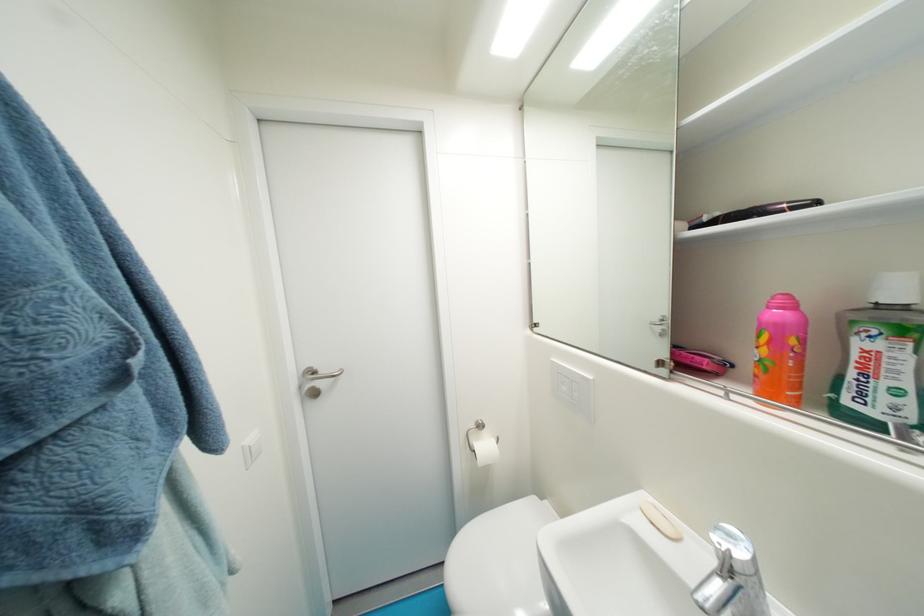
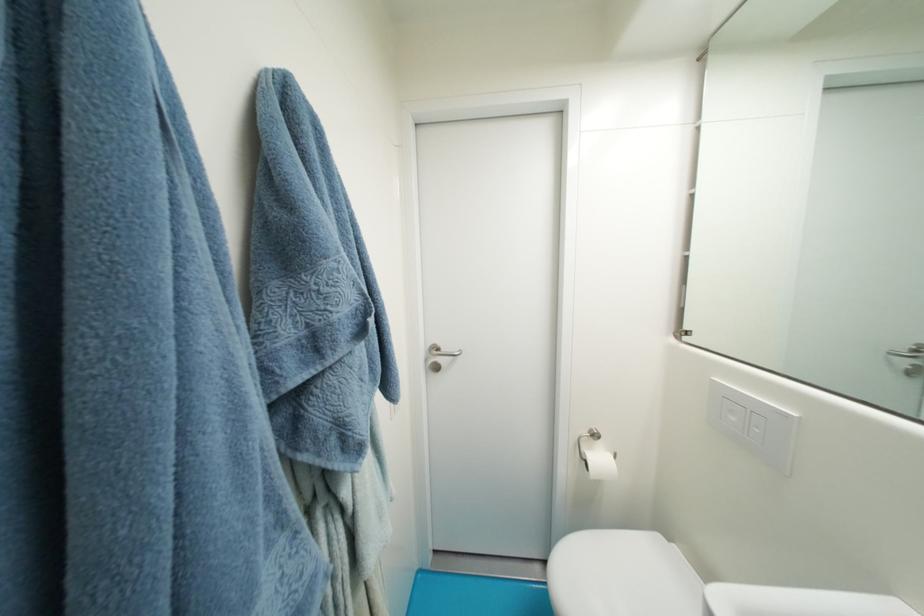
Question: The first image is from the beginning of the video and the second image is from the end. How did the camera likely rotate when shooting the video?

Choices:
 (A) Left
 (B) Right
 (C) Up
 (D) Down

Answer: (A)